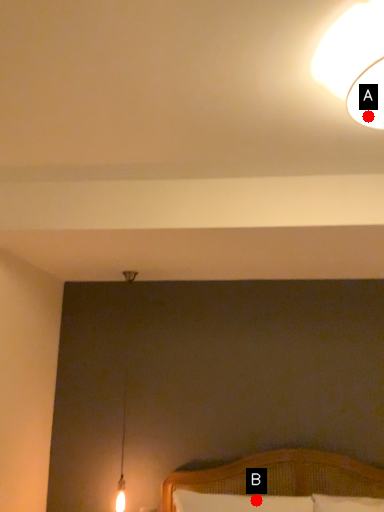
Question: Two points are circled on the image, labeled by A and B beside each circle. Which point is closer to the camera?

Choices:
 (A) A is closer
 (B) B is closer

Answer: (A)